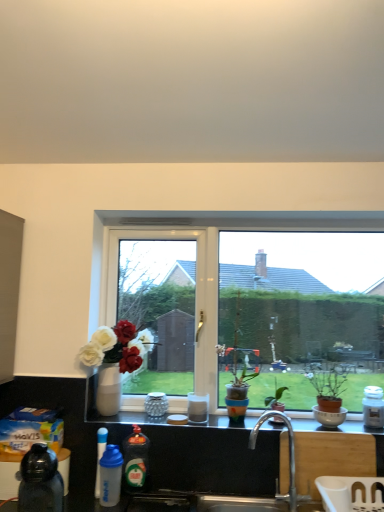
Question: Is white matte jar at right, the 5th bottle from the front, at the back of white glossy coffee cup at center, which is the first coffee cup in front-to-back order?

Choices:
 (A) yes
 (B) no

Answer: (B)

Question: Can you confirm if white glossy coffee cup at center, the 2th coffee cup viewed from the back, is positioned to the right of white matte jar at right, the first bottle positioned from the back?

Choices:
 (A) no
 (B) yes

Answer: (A)

Question: Is the position of white glossy coffee cup at center, the second coffee cup viewed from the left, more distant than that of white matte jar at right, arranged as the fifth bottle when viewed from the left?

Choices:
 (A) no
 (B) yes

Answer: (B)

Question: Is white glossy coffee cup at center, the second coffee cup viewed from the left, not near white matte jar at right, the 5th bottle from the front?

Choices:
 (A) yes
 (B) no

Answer: (B)

Question: From a real-world perspective, is white glossy coffee cup at center, placed as the 1th coffee cup when sorted from right to left, under white matte jar at right, which appears as the first bottle when viewed from the right?

Choices:
 (A) no
 (B) yes

Answer: (B)

Question: From a real-world perspective, is white glossy window at center positioned above or below black matte water bottle at lower left, the 5th bottle when ordered from right to left?

Choices:
 (A) above
 (B) below

Answer: (A)

Question: Visually, is white glossy window at center positioned to the left or to the right of black matte water bottle at lower left, positioned as the 1th bottle in left-to-right order?

Choices:
 (A) right
 (B) left

Answer: (A)

Question: Considering the positions of point (321, 245) and point (44, 486), is point (321, 245) closer or farther from the camera than point (44, 486)?

Choices:
 (A) closer
 (B) farther

Answer: (B)

Question: Is white glossy window at center in front of or behind black matte water bottle at lower left, positioned as the 1th bottle in left-to-right order, in the image?

Choices:
 (A) behind
 (B) front

Answer: (A)

Question: Is blue translucent bottle at lower left, acting as the third bottle starting from the back, wider or thinner than green matte plant at center, acting as the second houseplant starting from the left?

Choices:
 (A) wide
 (B) thin

Answer: (A)

Question: Visually, is blue translucent bottle at lower left, acting as the third bottle starting from the back, positioned to the left or to the right of green matte plant at center, the first houseplant positioned from the right?

Choices:
 (A) left
 (B) right

Answer: (A)

Question: From a real-world perspective, relative to green matte plant at center, the first houseplant positioned from the right, is blue translucent bottle at lower left, the 4th bottle viewed from the right, vertically above or below?

Choices:
 (A) above
 (B) below

Answer: (B)

Question: In terms of size, does blue translucent bottle at lower left, acting as the third bottle starting from the back, appear bigger or smaller than green matte plant at center, the first houseplant positioned from the right?

Choices:
 (A) small
 (B) big

Answer: (A)

Question: Considering the positions of white glossy coffee cup at center, which is the first coffee cup in front-to-back order, and blue translucent bottle at lower left, which is the 2th bottle from left to right, in the image, is white glossy coffee cup at center, which is the first coffee cup in front-to-back order, wider or thinner than blue translucent bottle at lower left, which is the 2th bottle from left to right,?

Choices:
 (A) wide
 (B) thin

Answer: (B)

Question: In the image, is white glossy coffee cup at center, the 2th coffee cup viewed from the back, on the left side or the right side of blue translucent bottle at lower left, the 4th bottle viewed from the right?

Choices:
 (A) left
 (B) right

Answer: (B)